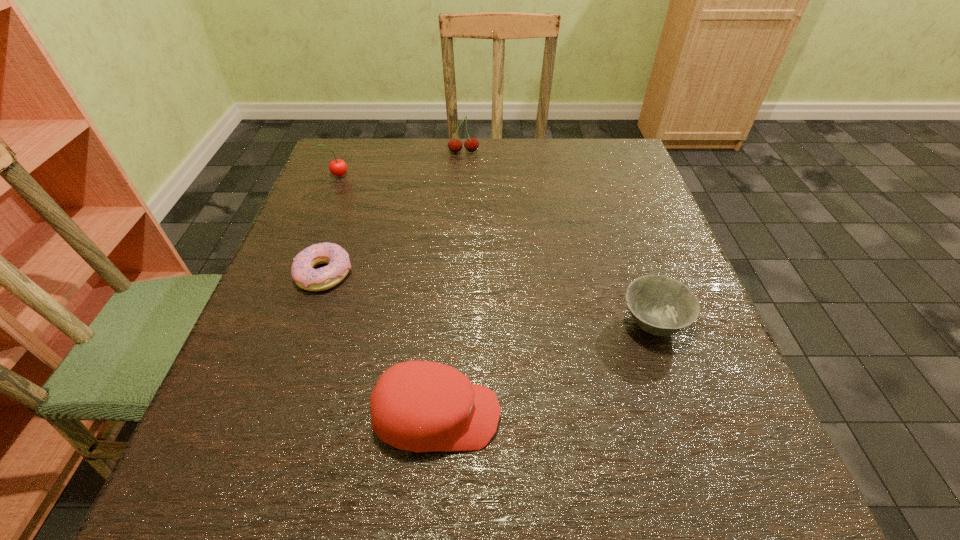
Where is `the right cherry`? This screenshot has width=960, height=540. the right cherry is located at coordinates point(471,144).

I want to click on the farther cherry, so click(x=471, y=144).

Identify the location of the nearer cherry. Image resolution: width=960 pixels, height=540 pixels. (338, 167).

Identify the location of the fourth nearest object. This screenshot has width=960, height=540. (338, 167).

Identify the location of the nearest object. 421,406.

Where is `the rightmost object`? This screenshot has height=540, width=960. the rightmost object is located at coordinates (661, 306).

The width and height of the screenshot is (960, 540). Find the location of `the second shortest object`. the second shortest object is located at coordinates (661, 306).

This screenshot has height=540, width=960. In order to click on the shortest object in this screenshot , I will do `click(303, 273)`.

Identify the location of doughnut. (303, 273).

Image resolution: width=960 pixels, height=540 pixels. I want to click on free space located 0.200m on the surface of the farther cherry, so coord(461,201).